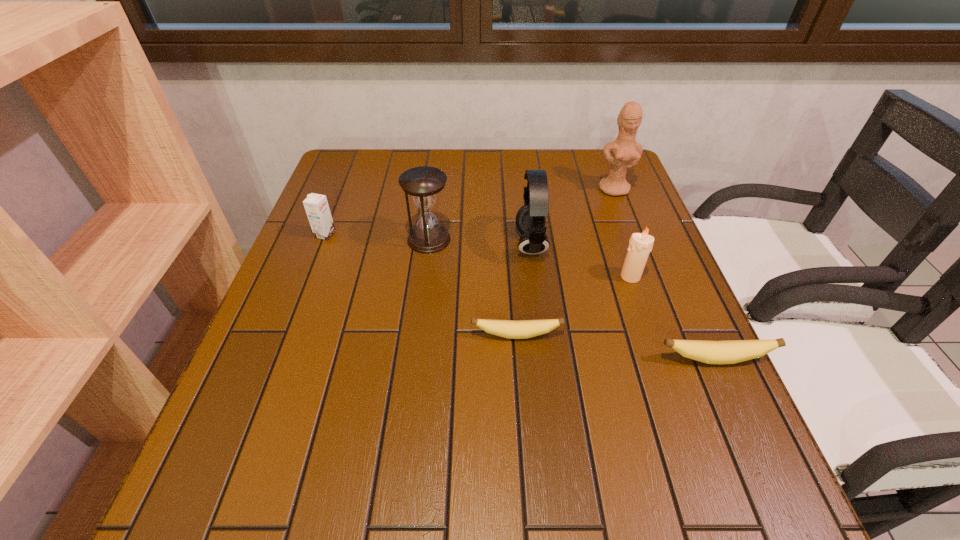
This screenshot has width=960, height=540. In order to click on the shorter banana in this screenshot , I will do `click(522, 329)`.

Find the location of `the sixth farthest object`. the sixth farthest object is located at coordinates (522, 329).

Where is `the nearest object`? The height and width of the screenshot is (540, 960). the nearest object is located at coordinates (732, 351).

Where is `the taller banana`? The image size is (960, 540). the taller banana is located at coordinates (732, 351).

Where is `the farthest object`? The image size is (960, 540). the farthest object is located at coordinates (626, 151).

Identify the location of figurine. (626, 151).

The height and width of the screenshot is (540, 960). Identify the location of earphone. (530, 220).

Where is `hourglass`? This screenshot has height=540, width=960. hourglass is located at coordinates (423, 184).

Locate an element on the screen. the leftmost object is located at coordinates (316, 205).

Identify the location of the fifth tallest object. The width and height of the screenshot is (960, 540). (316, 205).